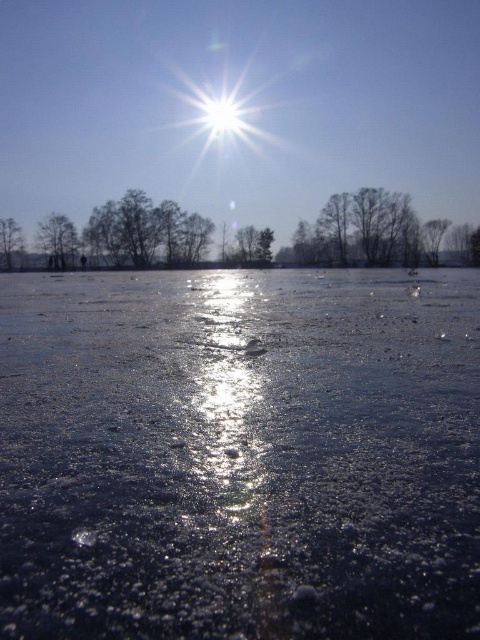
Which is above, silvery metallic tree at upper left or smooth gray tree at upper right?

smooth gray tree at upper right is higher up.

Based on the photo, is silvery metallic tree at upper left further to camera compared to smooth gray tree at upper right?

Yes.

Is point (41, 243) farther from camera compared to point (433, 230)?

Yes.

Where is `silvery metallic tree at upper left`? silvery metallic tree at upper left is located at coordinates (57, 237).

Who is higher up, transparent ice at center or smooth gray tree at left?

smooth gray tree at left is above.

Between transparent ice at center and smooth gray tree at left, which one has less height?

transparent ice at center

Between point (10, 362) and point (16, 241), which one is positioned behind?

Positioned behind is point (16, 241).

You are a GUI agent. You are given a task and a screenshot of the screen. Output one action in this format:
    pyautogui.click(x=<x>, y=<y>)
    Task: Click on the transparent ice at center
    
    Given the screenshot: What is the action you would take?
    point(240,456)

Can you confirm if transparent ice at center is smaller than smooth gray tree at upper right?

Indeed, transparent ice at center has a smaller size compared to smooth gray tree at upper right.

Which of these two, transparent ice at center or smooth gray tree at upper right, stands shorter?

transparent ice at center is shorter.

Which is behind, point (241, 328) or point (437, 236)?

The point (437, 236) is more distant.

Find the location of a particular element. transparent ice at center is located at coordinates (240, 456).